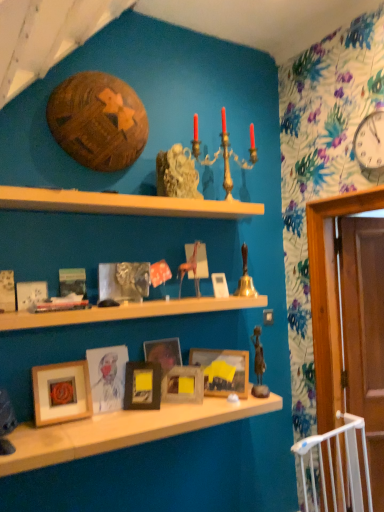
Question: Considering the relative sizes of wooden picture frame at lower left, the 6th picture frame when ordered from right to left, and wooden picture frame at center, marked as the 3th picture frame in a right-to-left arrangement, in the image provided, is wooden picture frame at lower left, the 6th picture frame when ordered from right to left, wider than wooden picture frame at center, marked as the 3th picture frame in a right-to-left arrangement,?

Choices:
 (A) yes
 (B) no

Answer: (A)

Question: Can you confirm if wooden picture frame at lower left, the 6th picture frame when ordered from right to left, is bigger than wooden picture frame at center, the fifth picture frame from the left?

Choices:
 (A) yes
 (B) no

Answer: (A)

Question: Is wooden picture frame at lower left, placed as the 2th picture frame when sorted from left to right, smaller than wooden picture frame at center, the fifth picture frame from the left?

Choices:
 (A) no
 (B) yes

Answer: (A)

Question: Are wooden picture frame at lower left, placed as the 2th picture frame when sorted from left to right, and wooden picture frame at center, marked as the 3th picture frame in a right-to-left arrangement, beside each other?

Choices:
 (A) no
 (B) yes

Answer: (A)

Question: Does wooden picture frame at lower left, the 6th picture frame when ordered from right to left, appear on the left side of wooden picture frame at center, marked as the 3th picture frame in a right-to-left arrangement?

Choices:
 (A) yes
 (B) no

Answer: (A)

Question: Is matte black picture frame at center, which ranks as the fourth picture frame in left-to-right order, wider or thinner than wooden picture frame at center, which ranks as the second picture frame in right-to-left order?

Choices:
 (A) wide
 (B) thin

Answer: (B)

Question: Does point (130, 397) appear closer or farther from the camera than point (244, 380)?

Choices:
 (A) closer
 (B) farther

Answer: (A)

Question: From the image's perspective, is matte black picture frame at center, which ranks as the fourth picture frame in left-to-right order, above or below wooden picture frame at center, arranged as the sixth picture frame when viewed from the left?

Choices:
 (A) below
 (B) above

Answer: (A)

Question: Based on their sizes in the image, would you say matte black picture frame at center, the fourth picture frame positioned from the right, is bigger or smaller than wooden picture frame at center, arranged as the sixth picture frame when viewed from the left?

Choices:
 (A) small
 (B) big

Answer: (A)

Question: Is point (152, 389) closer or farther from the camera than point (23, 309)?

Choices:
 (A) closer
 (B) farther

Answer: (B)

Question: From a real-world perspective, is matte black picture frame at center, the fourth picture frame positioned from the right, above or below matte white picture frame at center, which is counted as the first picture frame, starting from the left?

Choices:
 (A) above
 (B) below

Answer: (B)

Question: Considering the positions of matte black picture frame at center, which ranks as the fourth picture frame in left-to-right order, and matte white picture frame at center, acting as the seventh picture frame starting from the right, in the image, is matte black picture frame at center, which ranks as the fourth picture frame in left-to-right order, bigger or smaller than matte white picture frame at center, acting as the seventh picture frame starting from the right,?

Choices:
 (A) big
 (B) small

Answer: (A)

Question: Considering their positions, is matte black picture frame at center, the fourth picture frame positioned from the right, located in front of or behind matte white picture frame at center, acting as the seventh picture frame starting from the right?

Choices:
 (A) behind
 (B) front

Answer: (A)

Question: Considering the positions of white glossy clock at upper right and matte black picture frame at center, the fourth picture frame positioned from the right, in the image, is white glossy clock at upper right taller or shorter than matte black picture frame at center, the fourth picture frame positioned from the right,?

Choices:
 (A) tall
 (B) short

Answer: (A)

Question: Would you say white glossy clock at upper right is to the left or to the right of matte black picture frame at center, which ranks as the fourth picture frame in left-to-right order, in the picture?

Choices:
 (A) left
 (B) right

Answer: (B)